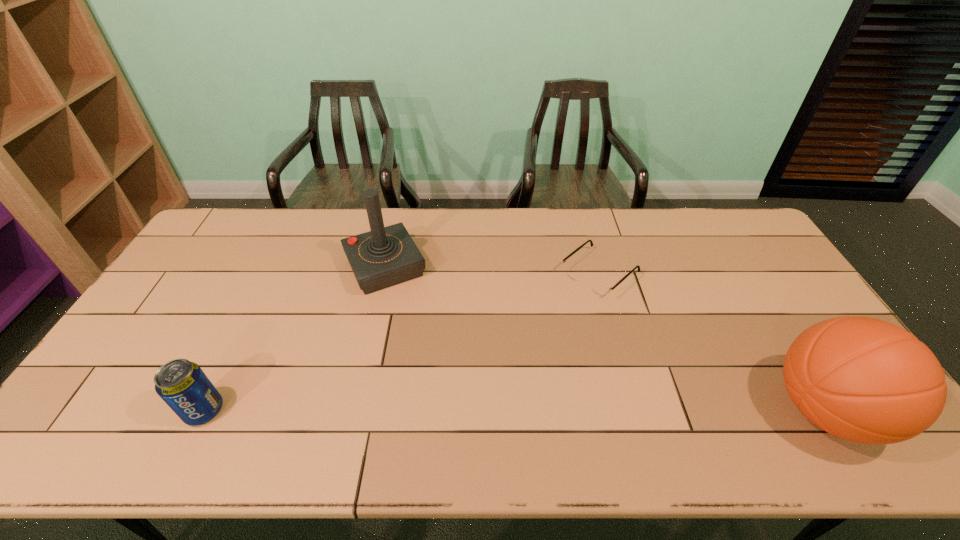
This screenshot has width=960, height=540. I want to click on free space at the far edge of the desktop, so click(385, 211).

Find the location of a particular element. This screenshot has height=540, width=960. free point at the near edge is located at coordinates (512, 409).

Where is `vacant space at the left edge of the desktop`? The height and width of the screenshot is (540, 960). vacant space at the left edge of the desktop is located at coordinates (152, 335).

Find the location of a particular element. vacant space at the right edge of the desktop is located at coordinates (750, 251).

Where is `vacant space at the near left corner of the desktop`? vacant space at the near left corner of the desktop is located at coordinates (83, 415).

Image resolution: width=960 pixels, height=540 pixels. In order to click on unoccupied area between the shortest object and the joystick in this screenshot , I will do `click(492, 271)`.

Where is `blank region between the soda and the shortest object`? blank region between the soda and the shortest object is located at coordinates (401, 342).

What are the coordinates of `vacant point located between the second object from right to left and the second shortest object` in the screenshot? It's located at (401, 342).

Identify the location of unoccupied position between the leftmost object and the joystick. (295, 339).

Find the location of a particular element. The height and width of the screenshot is (540, 960). vacant area that lies between the second object from right to left and the rightmost object is located at coordinates (712, 342).